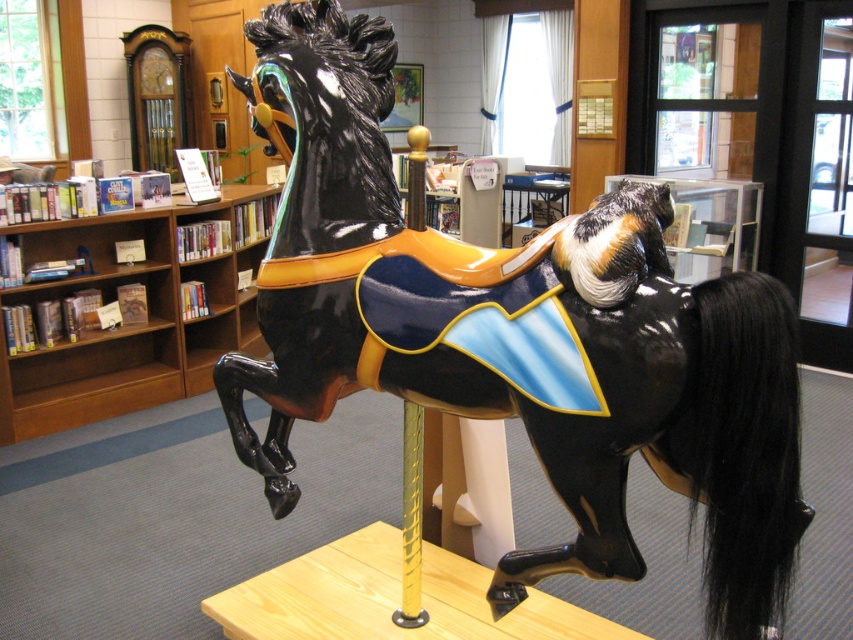
Based on the photo, is glossy black horse at center thinner than wooden bookshelf at left?

No.

Which of these two, glossy black horse at center or wooden bookshelf at left, stands shorter?

With less height is wooden bookshelf at left.

Identify the location of glossy black horse at center. This screenshot has height=640, width=853. (515, 336).